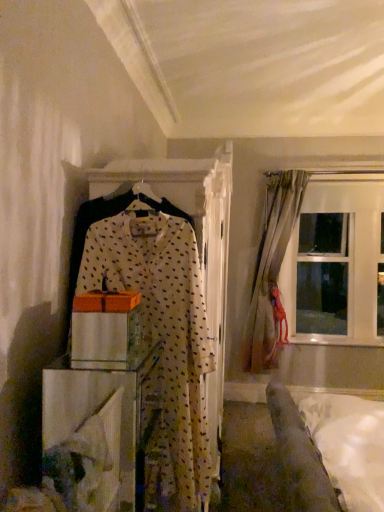
Question: Are white soft bed at lower right and white sheer with polka dots at center beside each other?

Choices:
 (A) no
 (B) yes

Answer: (A)

Question: From the image's perspective, is white soft bed at lower right over white sheer with polka dots at center?

Choices:
 (A) no
 (B) yes

Answer: (A)

Question: Does white soft bed at lower right come behind white sheer with polka dots at center?

Choices:
 (A) no
 (B) yes

Answer: (A)

Question: From the image's perspective, is white soft bed at lower right located beneath white sheer with polka dots at center?

Choices:
 (A) yes
 (B) no

Answer: (A)

Question: From a real-world perspective, is white soft bed at lower right under white sheer with polka dots at center?

Choices:
 (A) no
 (B) yes

Answer: (B)

Question: Could you tell me if white soft bed at lower right is turned towards white sheer with polka dots at center?

Choices:
 (A) no
 (B) yes

Answer: (B)

Question: Can you confirm if white sheer with polka dots at center is taller than transparent glass window at upper right?

Choices:
 (A) yes
 (B) no

Answer: (B)

Question: Is the position of white sheer with polka dots at center more distant than that of transparent glass window at upper right?

Choices:
 (A) yes
 (B) no

Answer: (B)

Question: Is white sheer with polka dots at center far from transparent glass window at upper right?

Choices:
 (A) yes
 (B) no

Answer: (A)

Question: Can you confirm if white sheer with polka dots at center is thinner than transparent glass window at upper right?

Choices:
 (A) yes
 (B) no

Answer: (A)

Question: Is white sheer with polka dots at center facing towards transparent glass window at upper right?

Choices:
 (A) no
 (B) yes

Answer: (A)

Question: Would you say white sheer with polka dots at center is outside transparent glass window at upper right?

Choices:
 (A) no
 (B) yes

Answer: (B)

Question: From the image's perspective, is white sheer with polka dots at center above light beige fabric curtain at right?

Choices:
 (A) no
 (B) yes

Answer: (A)